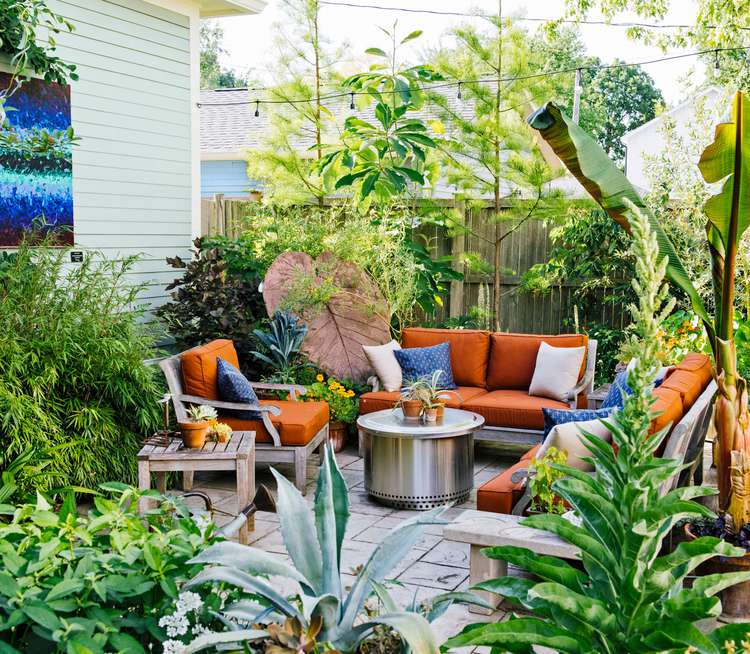
The width and height of the screenshot is (750, 654). In order to click on grey wooden chair in this screenshot , I will do `click(302, 458)`.